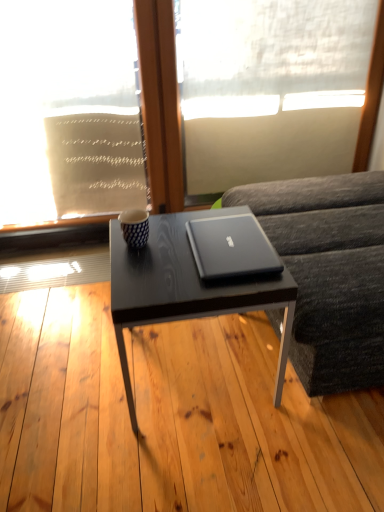
Question: From a real-world perspective, is matte black coffee table at center on top of matte black table at center?

Choices:
 (A) yes
 (B) no

Answer: (A)

Question: Is matte black coffee table at center oriented towards matte black table at center?

Choices:
 (A) yes
 (B) no

Answer: (B)

Question: Does matte black coffee table at center have a lesser height compared to matte black table at center?

Choices:
 (A) yes
 (B) no

Answer: (B)

Question: Are matte black coffee table at center and matte black table at center located far from each other?

Choices:
 (A) yes
 (B) no

Answer: (B)

Question: Can you confirm if matte black coffee table at center is smaller than matte black table at center?

Choices:
 (A) no
 (B) yes

Answer: (B)

Question: Is the surface of matte black coffee table at center in direct contact with matte black table at center?

Choices:
 (A) no
 (B) yes

Answer: (A)

Question: From the image's perspective, is dark gray fabric couch at right beneath matte black coffee table at center?

Choices:
 (A) yes
 (B) no

Answer: (B)

Question: Considering the relative sizes of dark gray fabric couch at right and matte black coffee table at center in the image provided, is dark gray fabric couch at right taller than matte black coffee table at center?

Choices:
 (A) no
 (B) yes

Answer: (B)

Question: Is dark gray fabric couch at right oriented towards matte black coffee table at center?

Choices:
 (A) no
 (B) yes

Answer: (B)

Question: Does dark gray fabric couch at right have a smaller size compared to matte black coffee table at center?

Choices:
 (A) yes
 (B) no

Answer: (B)

Question: Is dark gray fabric couch at right beside matte black coffee table at center?

Choices:
 (A) no
 (B) yes

Answer: (A)

Question: Can you confirm if dark gray fabric couch at right is shorter than matte black coffee table at center?

Choices:
 (A) no
 (B) yes

Answer: (A)

Question: Is white sheer fabric at upper left, acting as the 1th window screen starting from the left, at the back of white sheer fabric at upper center, the first window screen from the right?

Choices:
 (A) no
 (B) yes

Answer: (A)